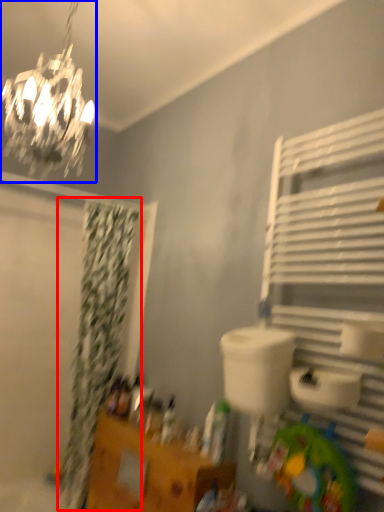
Question: Which of the following is the farthest to the observer, shower curtain (highlighted by a red box) or lamp (highlighted by a blue box)?

Choices:
 (A) shower curtain
 (B) lamp

Answer: (A)